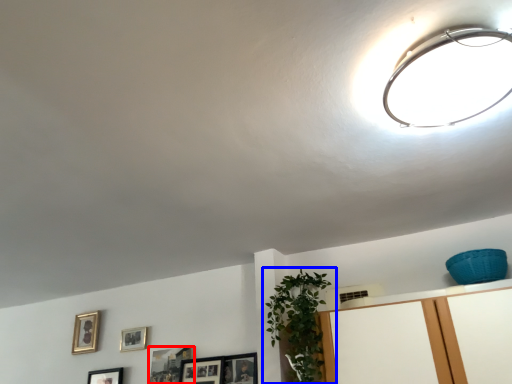
Question: Which object appears farthest to the camera in this image, picture frame (highlighted by a red box) or houseplant (highlighted by a blue box)?

Choices:
 (A) picture frame
 (B) houseplant

Answer: (A)